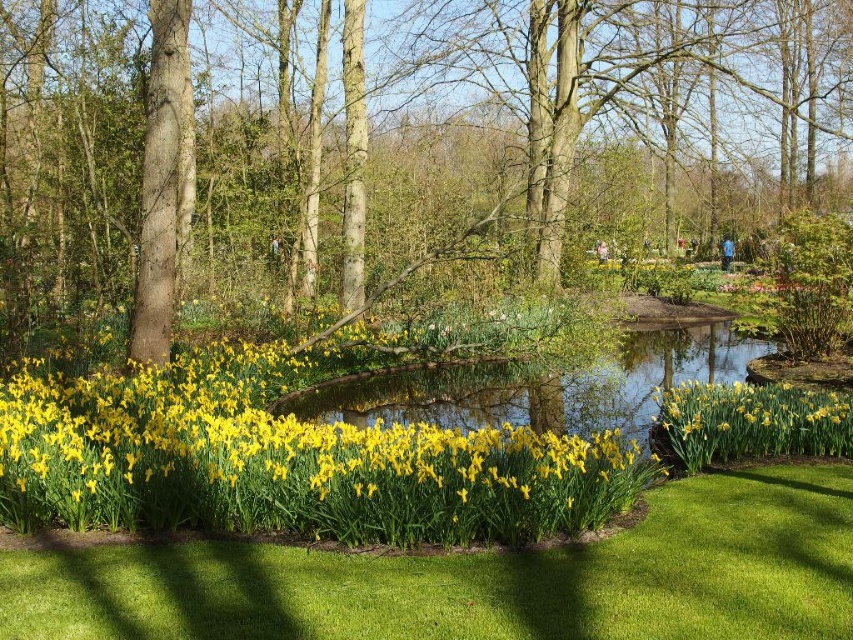
You are a gardener who wants to plant a new flower bed between the green leafy tree at center and the pond. The flower bed requires a minimum distance of 10 meters between the tree and the pond edge to thrive. Based on the scene, will this distance requirement be met?

The green leafy tree at center and the pond are 10.28 meters apart, which exceeds the required 10 meters. Therefore, the flower bed can be planted between them and meet the distance requirement.

You are a gardener who wants to plant a new flower bed. You have two options for daffodils from the garden scene. Which of the two, the yellow matte flowers at lower left or the yellow matte daffodil at lower center, would you choose if you want a thicker stem to withstand strong winds?

The yellow matte daffodil at lower center has a thicker stem than the yellow matte flowers at lower left, so it would be better suited to withstand strong winds.

You are a gardener who wants to plant a new flower bed between the green leafy tree at center and the green grass at lower center. Based on their heights, which object should you consider for ensuring the flowers are visible from the front of the garden?

The green grass at lower center is shorter than the green leafy tree at center, so planting the flower bed near the green grass at lower center would ensure better visibility from the front of the garden.